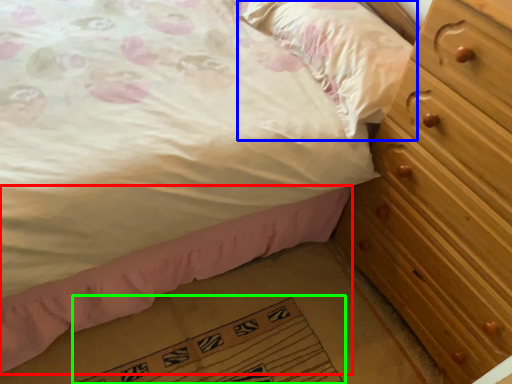
Question: Which object is positioned closest to bed frame (highlighted by a red box)? Select from pillow (highlighted by a blue box) and doormat (highlighted by a green box).

Choices:
 (A) pillow
 (B) doormat

Answer: (B)